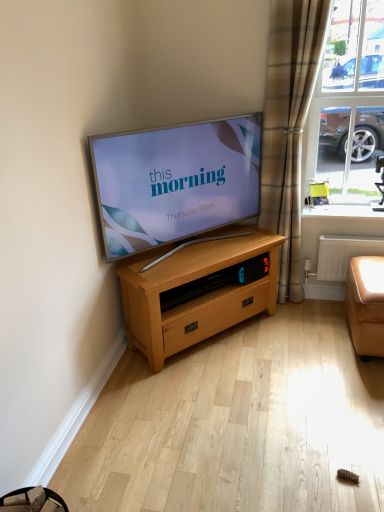
Question: In which direction should I rotate to look at light oak wooden chest of drawers at center?

Choices:
 (A) left
 (B) right

Answer: (B)

Question: From the image's perspective, is white glossy window sill at upper right under white plastic radiator at lower right?

Choices:
 (A) yes
 (B) no

Answer: (B)

Question: Is white glossy window sill at upper right positioned behind white plastic radiator at lower right?

Choices:
 (A) no
 (B) yes

Answer: (B)

Question: Can you confirm if white glossy window sill at upper right is bigger than white plastic radiator at lower right?

Choices:
 (A) no
 (B) yes

Answer: (A)

Question: Could white plastic radiator at lower right be considered to be inside white glossy window sill at upper right?

Choices:
 (A) yes
 (B) no

Answer: (B)

Question: Are white glossy window sill at upper right and white plastic radiator at lower right beside each other?

Choices:
 (A) no
 (B) yes

Answer: (A)

Question: Does white glossy window sill at upper right have a lesser height compared to white plastic radiator at lower right?

Choices:
 (A) no
 (B) yes

Answer: (B)

Question: Does clear glass window at upper right turn towards leather-like orange couch at lower right?

Choices:
 (A) no
 (B) yes

Answer: (A)

Question: Is leather-like orange couch at lower right surrounded by clear glass window at upper right?

Choices:
 (A) yes
 (B) no

Answer: (B)

Question: Considering the relative sizes of clear glass window at upper right and leather-like orange couch at lower right in the image provided, is clear glass window at upper right thinner than leather-like orange couch at lower right?

Choices:
 (A) yes
 (B) no

Answer: (A)

Question: Can we say clear glass window at upper right lies outside leather-like orange couch at lower right?

Choices:
 (A) yes
 (B) no

Answer: (A)

Question: Does clear glass window at upper right have a greater width compared to leather-like orange couch at lower right?

Choices:
 (A) yes
 (B) no

Answer: (B)

Question: Can you confirm if clear glass window at upper right is taller than leather-like orange couch at lower right?

Choices:
 (A) yes
 (B) no

Answer: (A)

Question: Is white plastic radiator at lower right aimed at light oak wooden chest of drawers at center?

Choices:
 (A) yes
 (B) no

Answer: (B)